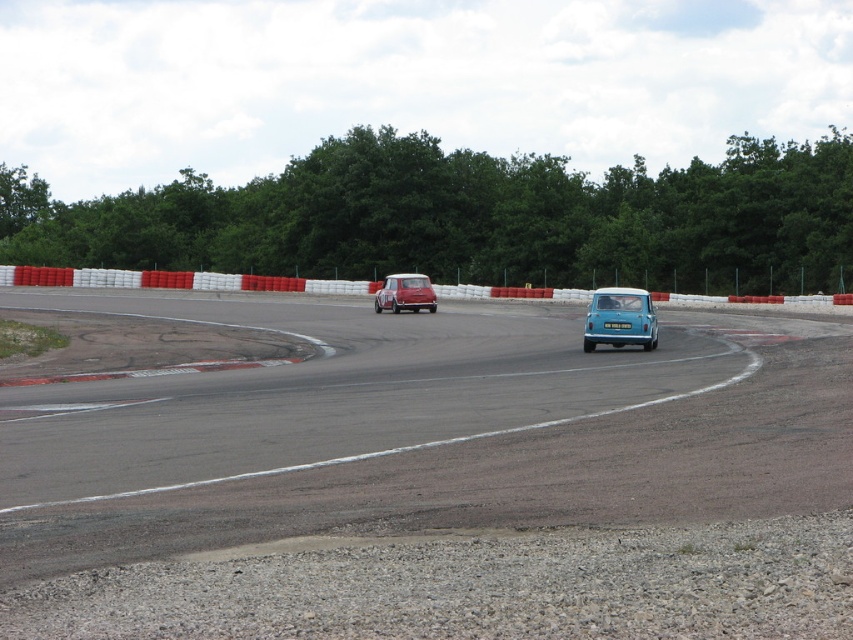
Can you confirm if smooth asphalt race track at lower left is bigger than red plastic barrier at center?

Incorrect, smooth asphalt race track at lower left is not larger than red plastic barrier at center.

Which is in front, point (67, 504) or point (364, 285)?

Point (67, 504) is more forward.

Locate an element on the screen. Image resolution: width=853 pixels, height=640 pixels. smooth asphalt race track at lower left is located at coordinates (433, 477).

Can you confirm if red plastic barrier at center is shorter than matte red car at center?

In fact, red plastic barrier at center may be taller than matte red car at center.

This screenshot has width=853, height=640. I want to click on red plastic barrier at center, so click(173, 280).

Which is in front, point (456, 285) or point (379, 307)?

Point (379, 307) is in front.

Where is `red plastic barrier at center`? The width and height of the screenshot is (853, 640). red plastic barrier at center is located at coordinates (173, 280).

From the picture: Who is higher up, smooth asphalt race track at lower left or matte red car at center?

matte red car at center is above.

Which of these two, smooth asphalt race track at lower left or matte red car at center, stands taller?

With more height is matte red car at center.

Is point (245, 563) behind point (410, 273)?

No, (245, 563) is closer to viewer.

The width and height of the screenshot is (853, 640). Identify the location of smooth asphalt race track at lower left. (433, 477).